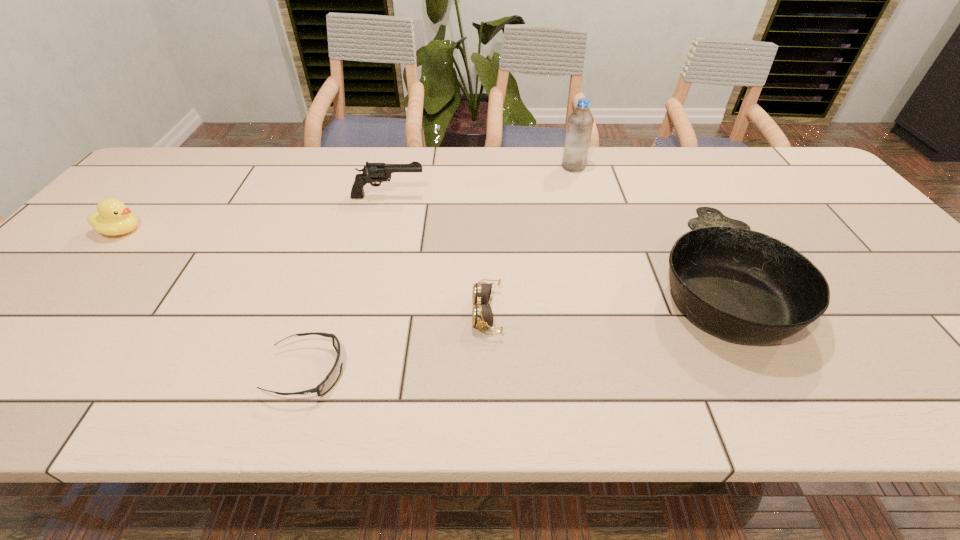
You are a GUI agent. You are given a task and a screenshot of the screen. Output one action in this format:
    pyautogui.click(x=<x>, y=<y>)
    Task: Click on the vacant region located with the handle extending from the side of the rightmost object
    This screenshot has width=960, height=540.
    Given the screenshot: What is the action you would take?
    pyautogui.click(x=660, y=173)

Identify the location of vacant space positioned 0.250m with the handle extending from the side of the rightmost object. The width and height of the screenshot is (960, 540). (661, 178).

Where is `vacant space situated 0.060m with the handle extending from the side of the rightmost object`? Image resolution: width=960 pixels, height=540 pixels. vacant space situated 0.060m with the handle extending from the side of the rightmost object is located at coordinates 682,215.

Identify the location of vacant space located on the beak of the duckling. This screenshot has height=540, width=960. (166, 231).

This screenshot has height=540, width=960. Identify the location of free space located 0.070m through the lenses of the right goggles. (441, 313).

Where is `vacant point located through the lenses of the right goggles`? The width and height of the screenshot is (960, 540). vacant point located through the lenses of the right goggles is located at coordinates (449, 313).

What are the coordinates of `free spot located 0.400m through the lenses of the right goggles` in the screenshot? It's located at (292, 313).

This screenshot has height=540, width=960. I want to click on free point located on the lenses of the left goggles, so pyautogui.click(x=431, y=372).

At what (x,y) coordinates should I click in order to perform the action: click on object present at the far edge. Please return your answer as a coordinate pair (x, y). This screenshot has height=540, width=960. Looking at the image, I should click on (580, 122).

Where is `object at the near edge`? This screenshot has width=960, height=540. object at the near edge is located at coordinates (332, 377).